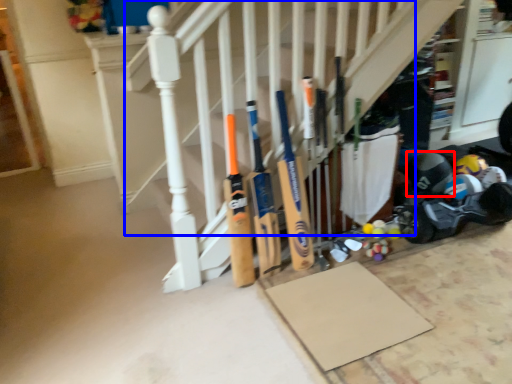
Question: Which object is closer to the camera taking this photo, helmet (highlighted by a red box) or stairs (highlighted by a blue box)?

Choices:
 (A) helmet
 (B) stairs

Answer: (B)